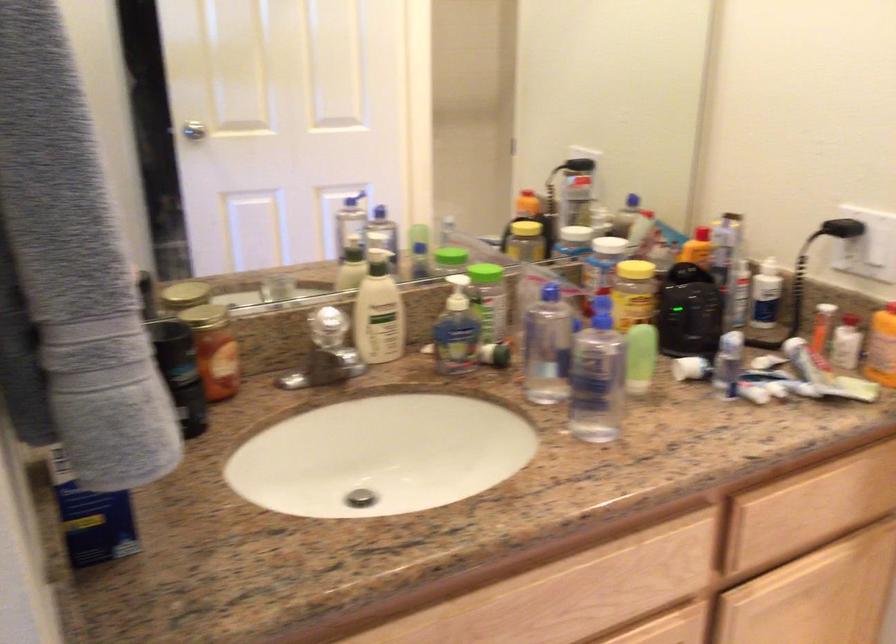
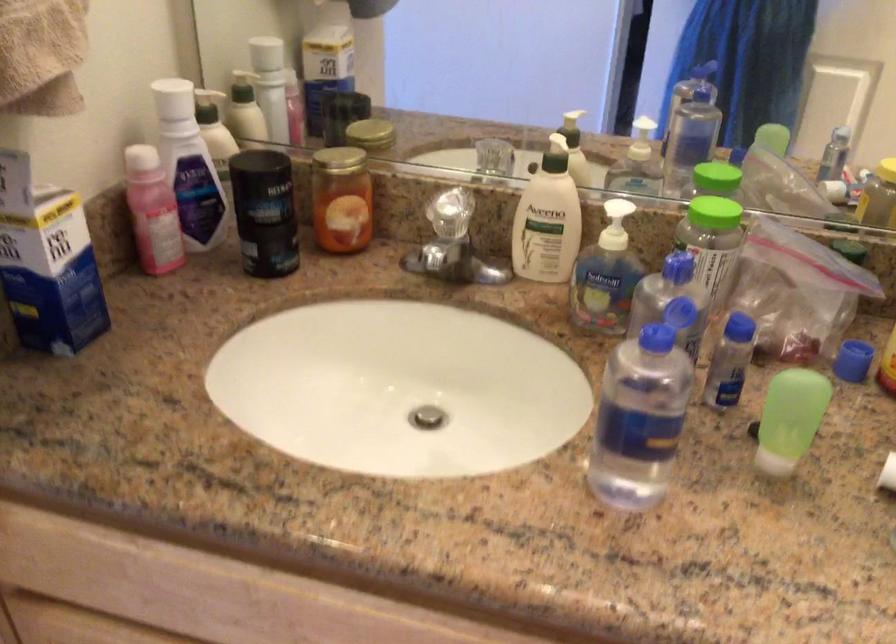
Locate, in the second image, the point that corresponds to (x=461, y=254) in the first image.

(716, 178)